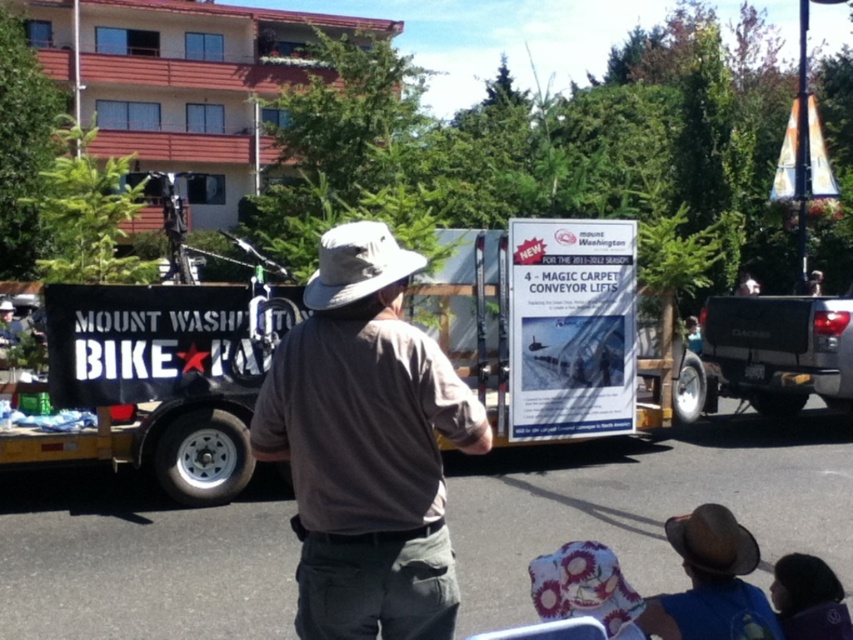
You are a photographer positioned at the center of the scene. You want to take a photo that includes both the matte black truck at right and the brown felt cowboy hat at lower center. Which object should you pan your camera towards first to ensure both are in frame?

You should pan your camera towards the brown felt cowboy hat at lower center first because the matte black truck at right is to the right of it, so starting with the hat ensures the truck will be within the frame when panning right.

You are a photographer setting up equipment for the event. You need to position your camera so that both the black matte trailer at center and the matte black truck at right are in frame. Given their sizes, which object should you ensure is closer to the camera to avoid it being too small in the photo?

Since the black matte trailer at center is wider than the matte black truck at right, you should position the matte black truck at right closer to the camera to ensure it appears large enough in the photo.